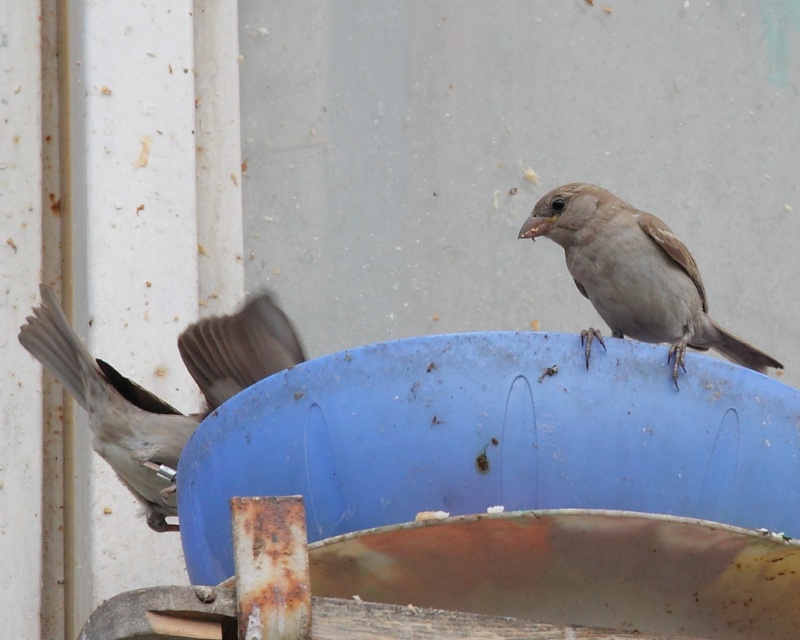
Who is lower down, gray matte sparrow at left or gray matte sparrow at upper right?

gray matte sparrow at left is lower down.

Which is more to the right, gray matte sparrow at left or gray matte sparrow at upper right?

Positioned to the right is gray matte sparrow at upper right.

Between point (204, 396) and point (592, 211), which one is positioned behind?

The point (204, 396) is behind.

Locate an element on the screen. The image size is (800, 640). gray matte sparrow at left is located at coordinates (154, 394).